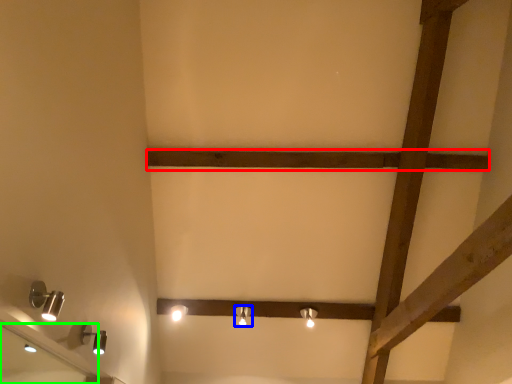
Question: Which object is the closest to the plank (highlighted by a red box)? Choose among these: lamp (highlighted by a blue box) or mirror (highlighted by a green box).

Choices:
 (A) lamp
 (B) mirror

Answer: (A)